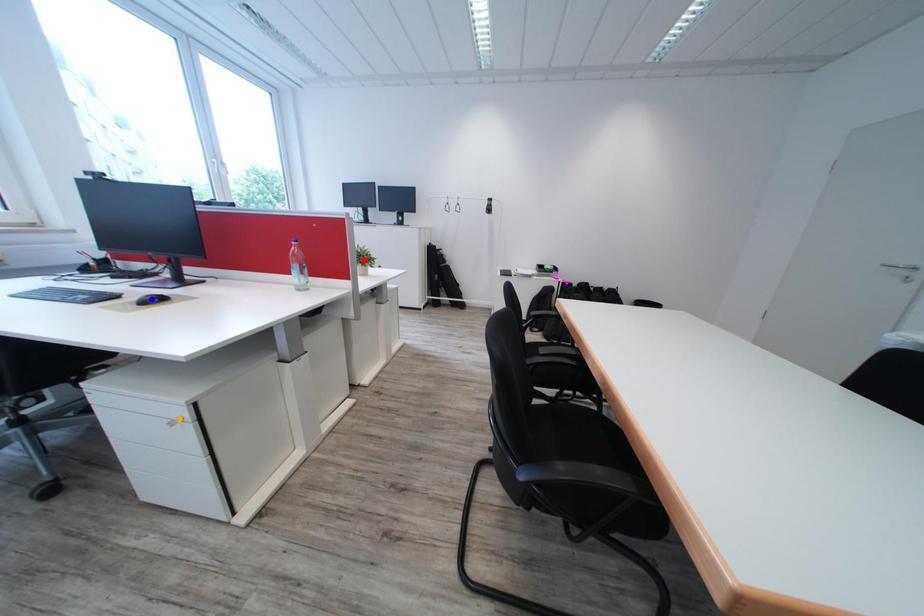
Consider the image. Order these from nearest to farthest:
red point | orange point | blue point

orange point
blue point
red point